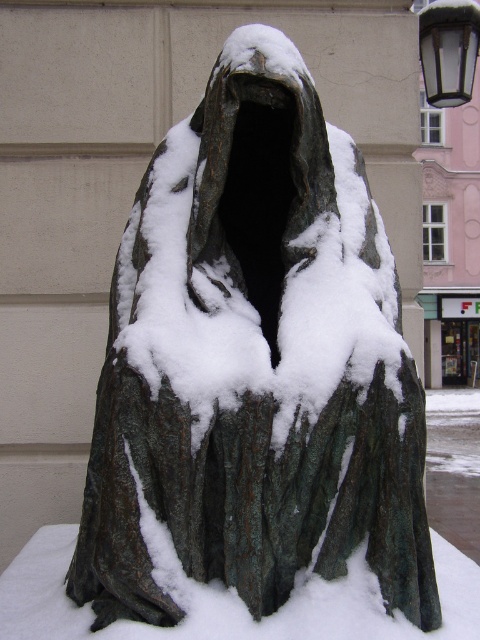
Is white frosty snow at center above metallic glass lamp at upper right?

Actually, white frosty snow at center is below metallic glass lamp at upper right.

Can you confirm if white frosty snow at center is positioned to the left of metallic glass lamp at upper right?

Indeed, white frosty snow at center is positioned on the left side of metallic glass lamp at upper right.

Find the location of a particular element. The width and height of the screenshot is (480, 640). white frosty snow at center is located at coordinates (233, 602).